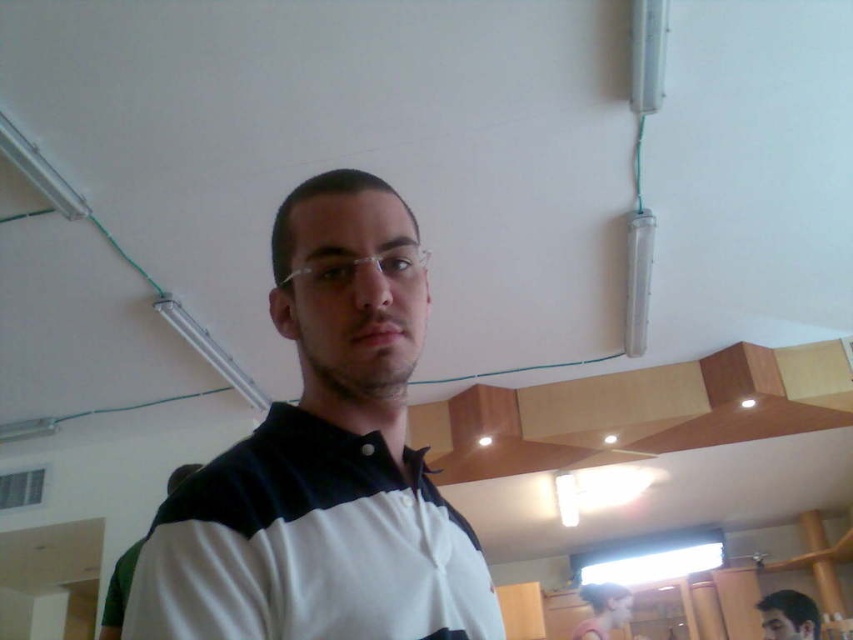
You are a photographer setting up for a group photo. You notice the white matte shirt at center and the clear plastic glasses at center on the person. To ensure both are in focus, what is the minimum distance you should set your camera lens to focus at?

The minimum focus distance should be at least 10.99 centimeters to ensure both the white matte shirt at center and the clear plastic glasses at center are in focus since they are 10.99 centimeters apart.

You are a photographer setting up for a group photo. You notice the white matte shirt at center and the clear plastic glasses at center in your frame. Which object is wider in the image?

The white matte shirt at center is wider than the clear plastic glasses at center.